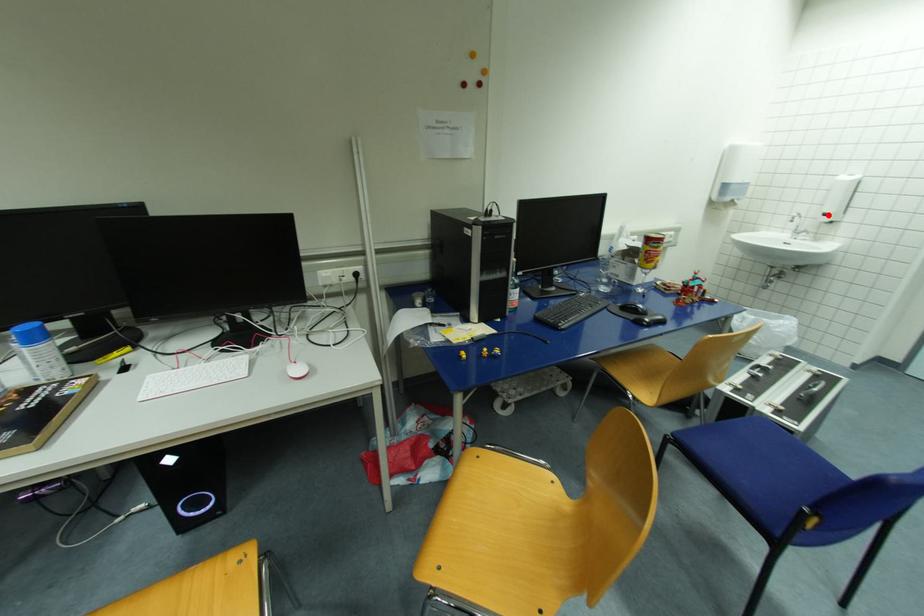
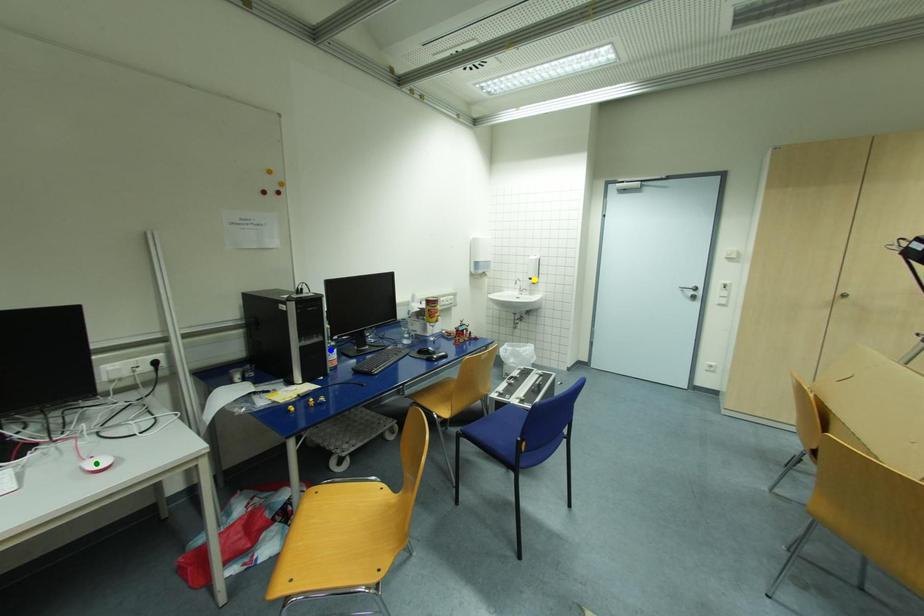
Question: I am providing you with two images of the same scene from different viewpoints. A red point is marked on the first image. You are given multiple points on the second image. Which mark in image 2 goes with the point in image 1?

Choices:
 (A) blue point
 (B) yellow point
 (C) green point

Answer: (B)